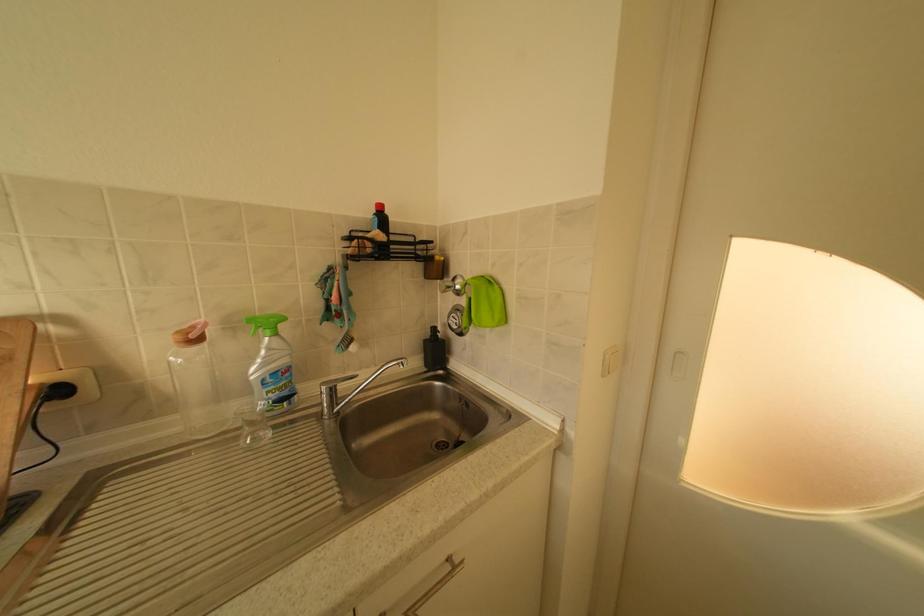
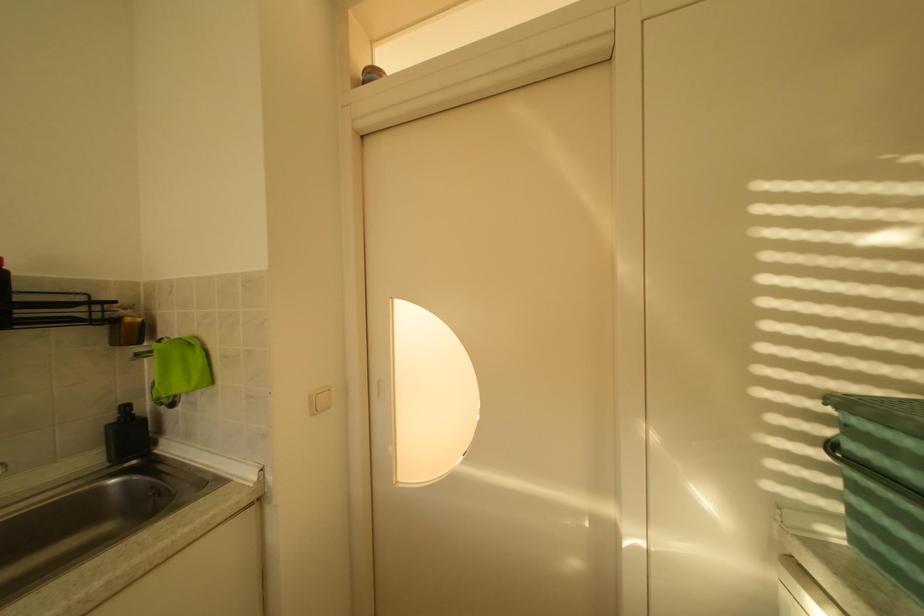
Question: How did the camera likely rotate?

Choices:
 (A) Left
 (B) Right
 (C) Up
 (D) Down

Answer: (B)